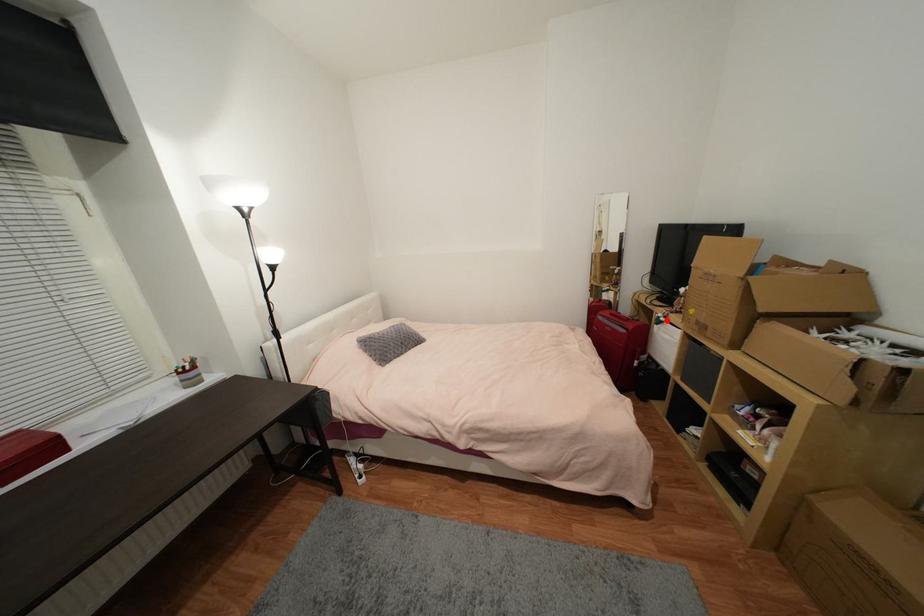
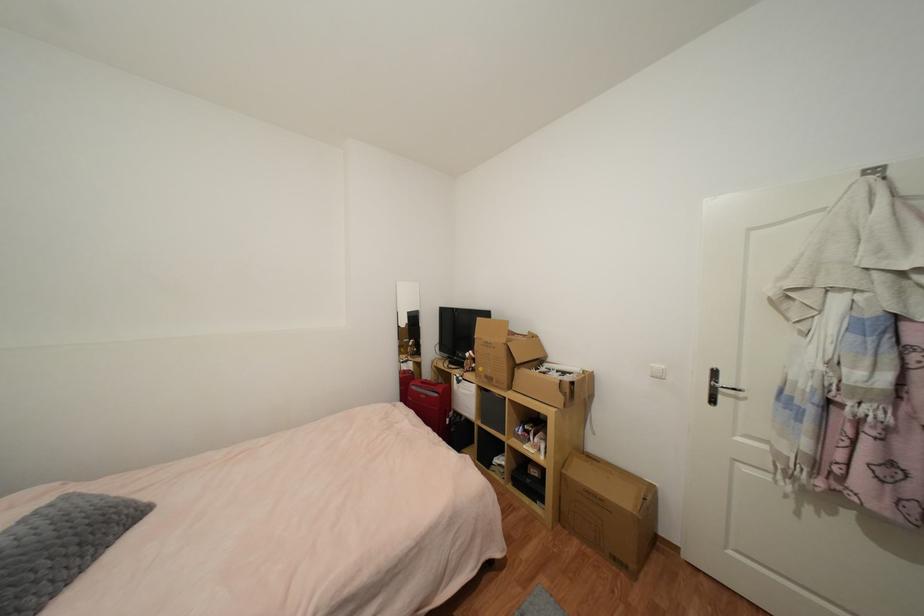
Question: I am providing you with two images of the same scene from different viewpoints. Image1 has a red point marked. In image2, the corresponding 3D location appears at what relative position? Reply with the corresponding letter.

Choices:
 (A) Closer
 (B) Farther

Answer: (B)